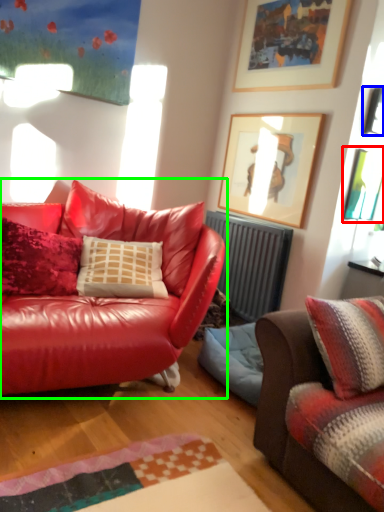
Question: Based on their relative distances, which object is nearer to picture frame (highlighted by a red box)? Choose from picture frame (highlighted by a blue box) and studio couch (highlighted by a green box).

Choices:
 (A) picture frame
 (B) studio couch

Answer: (A)